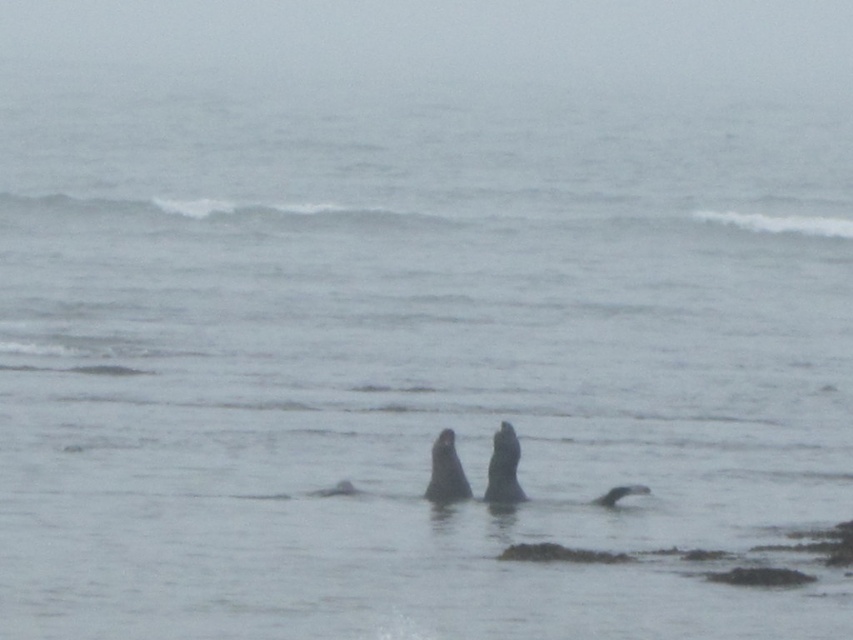
Question: Which is farther from the dark gray fur seal at lower center?

Choices:
 (A) gray matte seal at center
 (B) dark gray fur seal at center

Answer: (B)

Question: Is gray matte seal at center positioned before dark gray fur seal at lower center?

Choices:
 (A) yes
 (B) no

Answer: (A)

Question: Can you confirm if gray matte seal at center is wider than dark gray fur seal at center?

Choices:
 (A) yes
 (B) no

Answer: (B)

Question: Estimate the real-world distances between objects in this image. Which object is closer to the dark gray fur seal at center?

Choices:
 (A) dark gray fur seal at lower center
 (B) gray matte seal at center

Answer: (B)

Question: Can you confirm if gray matte seal at center is wider than dark gray fur seal at center?

Choices:
 (A) no
 (B) yes

Answer: (A)

Question: Considering the real-world distances, which object is farthest from the dark gray fur seal at lower center?

Choices:
 (A) dark gray fur seal at center
 (B) gray matte seal at center

Answer: (A)